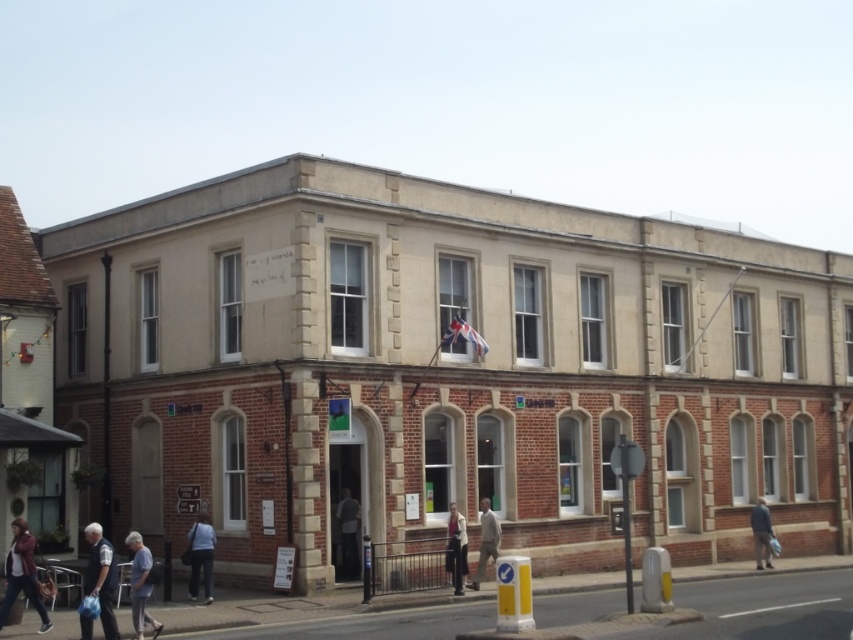
Question: Estimate the real-world distances between objects in this image. Which object is closer to the leather jacket at lower left?

Choices:
 (A) light beige fabric jacket at center
 (B) denim jacket at lower left
 (C) dark blue jacket at lower right

Answer: (B)

Question: Can you confirm if light blue shirt at lower left is wider than dark blue jacket at lower right?

Choices:
 (A) yes
 (B) no

Answer: (B)

Question: Which point is farther to the camera?

Choices:
 (A) denim jacket at lower left
 (B) light blue shirt at lower left
 (C) light beige fabric jacket at center
 (D) leather jacket at lower left

Answer: (C)

Question: Is light blue shirt at lower left to the right of dark gray fabric jacket at center from the viewer's perspective?

Choices:
 (A) yes
 (B) no

Answer: (B)

Question: Is denim jacket at lower left further to camera compared to light beige fabric jacket at center?

Choices:
 (A) yes
 (B) no

Answer: (B)

Question: Based on their relative distances, which object is nearer to the light blue shirt at lower left?

Choices:
 (A) light beige fabric jacket at center
 (B) light brown leather jacket at center
 (C) leather jacket at lower left

Answer: (C)